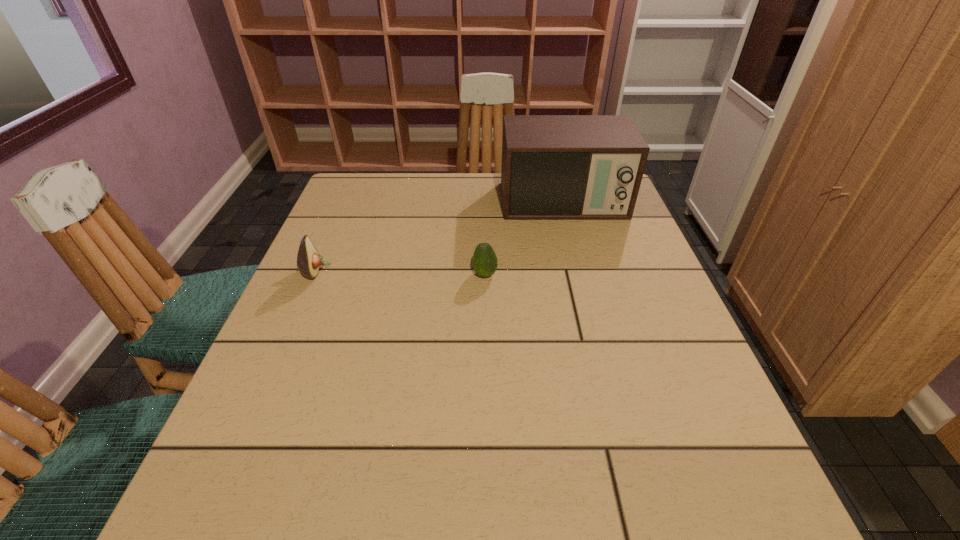
Find the location of a particular element. This screenshot has height=540, width=960. object that is at the left edge is located at coordinates (308, 260).

At what (x,y) coordinates should I click in order to perform the action: click on object at the right edge. Please return your answer as a coordinate pair (x, y). The height and width of the screenshot is (540, 960). Looking at the image, I should click on (554, 167).

In order to click on object that is at the far right corner in this screenshot , I will do `click(554, 167)`.

Where is `vacant space at the far edge of the desktop`? The height and width of the screenshot is (540, 960). vacant space at the far edge of the desktop is located at coordinates (419, 177).

In the image, there is a desktop. Identify the location of vacant area at the near edge. (372, 523).

Locate an element on the screen. free space at the left edge is located at coordinates (317, 369).

Where is `free space at the right edge of the desktop`? free space at the right edge of the desktop is located at coordinates (612, 260).

Image resolution: width=960 pixels, height=540 pixels. Find the location of `free point at the near right corner`. free point at the near right corner is located at coordinates (694, 503).

Identify the location of free spot between the shortest object and the farthest object. This screenshot has width=960, height=540. (524, 239).

Locate an element on the screen. Image resolution: width=960 pixels, height=540 pixels. vacant region between the tallest object and the taller avocado is located at coordinates (440, 237).